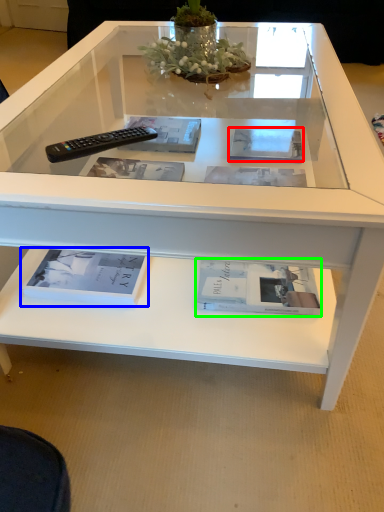
Question: Which object is the closest to the magazine (highlighted by a red box)? Choose among these: book (highlighted by a blue box) or book (highlighted by a green box).

Choices:
 (A) book
 (B) book

Answer: (B)